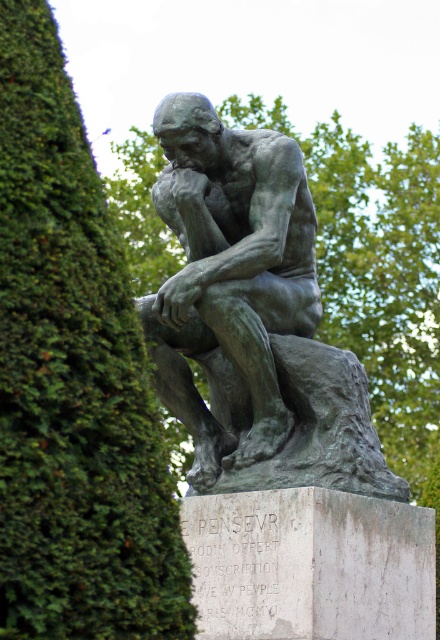
Can you confirm if green mossy hedge at left is positioned above bronze statue at center?

No.

This screenshot has height=640, width=440. What do you see at coordinates (73, 380) in the screenshot?
I see `green mossy hedge at left` at bounding box center [73, 380].

Find the location of `green mossy hedge at left`. green mossy hedge at left is located at coordinates coord(73,380).